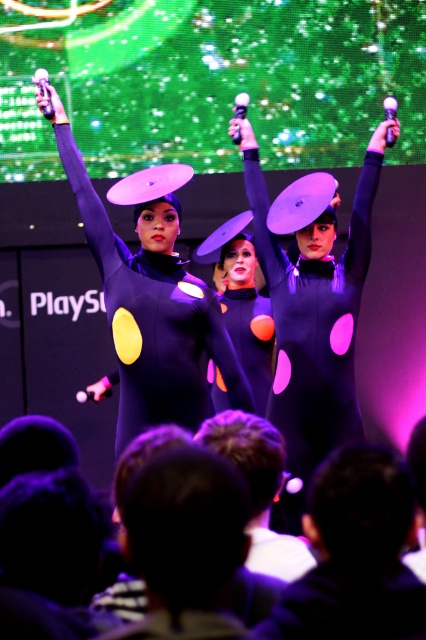
Does matte black costume at center appear on the right side of black matte head at upper center?

No, matte black costume at center is not to the right of black matte head at upper center.

Can you confirm if matte black costume at center is shorter than black matte head at upper center?

No, matte black costume at center is not shorter than black matte head at upper center.

This screenshot has width=426, height=640. What are the coordinates of `matte black costume at center` in the screenshot? It's located at (154, 321).

This screenshot has height=640, width=426. What do you see at coordinates (154, 321) in the screenshot?
I see `matte black costume at center` at bounding box center [154, 321].

Between matte black costume at center and black hair at lower center, which one has less height?

black hair at lower center

This screenshot has width=426, height=640. I want to click on matte black costume at center, so click(x=154, y=321).

The height and width of the screenshot is (640, 426). I want to click on matte black costume at center, so click(x=154, y=321).

Which is in front, point (305, 528) or point (134, 636)?

Point (134, 636) is more forward.

Is point (388, 624) farther from camera compared to point (178, 476)?

No.

Is point (325, 568) behind point (206, 477)?

Yes.

The width and height of the screenshot is (426, 640). Find the location of `black matte head at upper center`. black matte head at upper center is located at coordinates (354, 554).